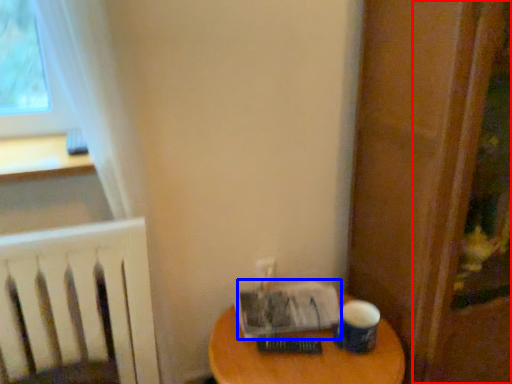
Question: Among these objects, which one is nearest to the camera, screen door (highlighted by a red box) or paperback book (highlighted by a blue box)?

Choices:
 (A) screen door
 (B) paperback book

Answer: (A)